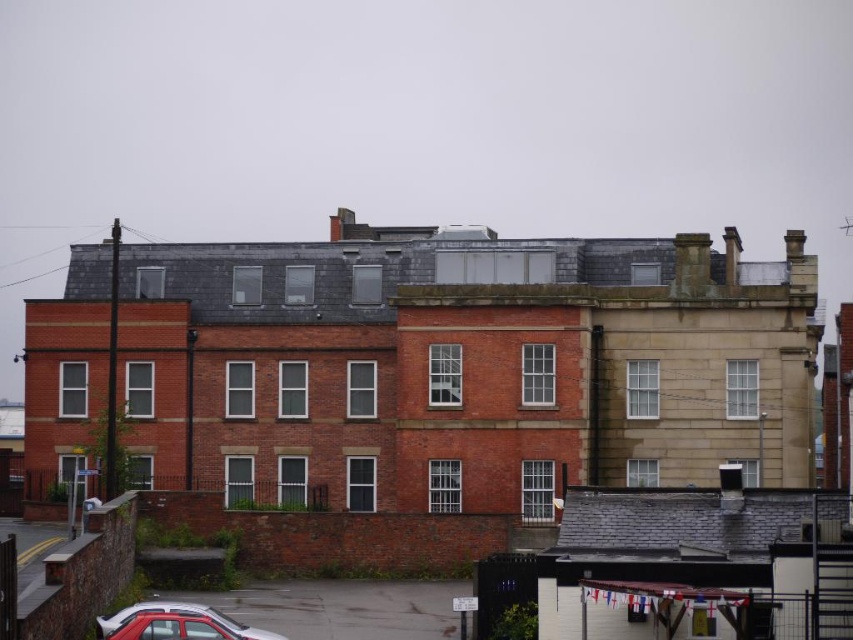
Between brightly colored fabric at lower right and metallic silver car at lower left, which one has more height?

metallic silver car at lower left

Does brightly colored fabric at lower right have a greater width compared to metallic silver car at lower left?

Incorrect, brightly colored fabric at lower right's width does not surpass metallic silver car at lower left's.

Is point (694, 588) less distant than point (244, 636)?

Yes, it is.

The width and height of the screenshot is (853, 640). Identify the location of brightly colored fabric at lower right. [659, 595].